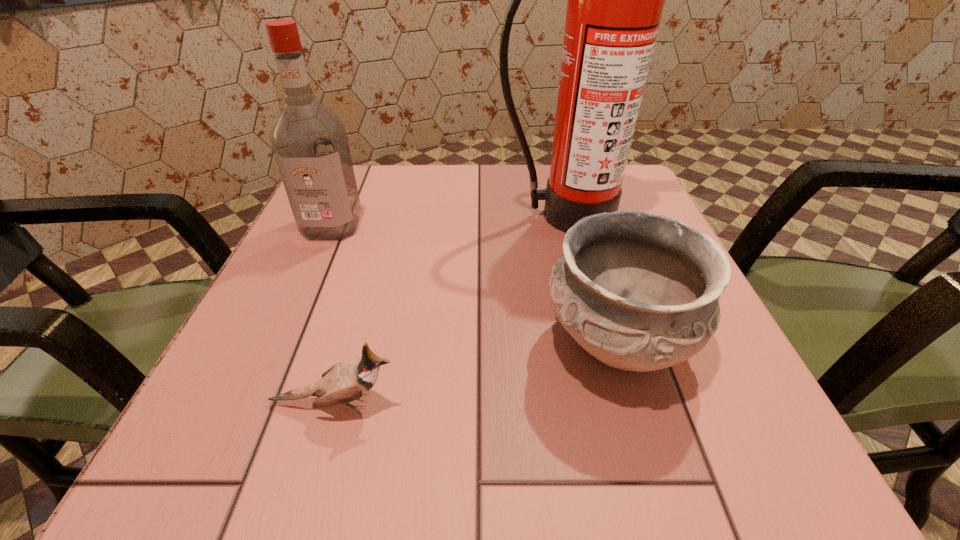
Find the location of a particular element. This screenshot has width=960, height=540. vacant region at the left edge of the desktop is located at coordinates (332, 256).

The height and width of the screenshot is (540, 960). In the image, there is a desktop. Find the location of `vacant space at the right edge`. vacant space at the right edge is located at coordinates (745, 403).

The image size is (960, 540). Identify the location of blank space at the far left corner of the desktop. (375, 164).

In the image, there is a desktop. Where is `free region at the far right corner`? The image size is (960, 540). free region at the far right corner is located at coordinates (624, 205).

Identify the location of vacant area that lies between the liquor and the tallest object. (448, 220).

Locate an element on the screen. The image size is (960, 540). empty space that is in between the bird and the fire extinguisher is located at coordinates (449, 309).

Locate an element on the screen. The image size is (960, 540). free area in between the fire extinguisher and the bird is located at coordinates (449, 309).

Where is `free point between the tallest object and the third shortest object`? free point between the tallest object and the third shortest object is located at coordinates (448, 220).

This screenshot has height=540, width=960. In order to click on unoccupied position between the tallest object and the shortest object in this screenshot , I will do `click(449, 309)`.

The image size is (960, 540). I want to click on unoccupied area between the liquor and the second shortest object, so click(x=474, y=284).